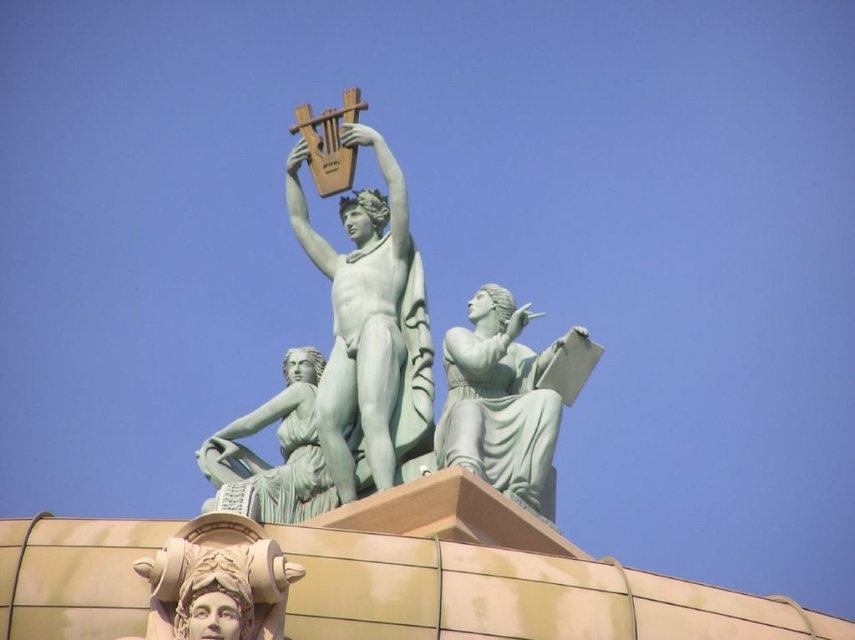
Question: Which object is the closest to the green marble statue at center?

Choices:
 (A) smooth beige statue at lower center
 (B) green marble lyre at center
 (C) green patina statue at lower left

Answer: (B)

Question: Which object is positioned farthest from the green marble statue at center?

Choices:
 (A) green patina statue at lower left
 (B) green marble lyre at center
 (C) smooth beige statue at lower center

Answer: (C)

Question: Is green marble lyre at center to the left of green patina statue at lower left from the viewer's perspective?

Choices:
 (A) yes
 (B) no

Answer: (B)

Question: Which object is closer to the camera taking this photo?

Choices:
 (A) green marble lyre at center
 (B) smooth beige statue at lower center

Answer: (B)

Question: Does green marble lyre at center come behind smooth beige statue at lower center?

Choices:
 (A) no
 (B) yes

Answer: (B)

Question: Can you confirm if smooth beige statue at lower center is wider than green patina statue at lower left?

Choices:
 (A) yes
 (B) no

Answer: (B)